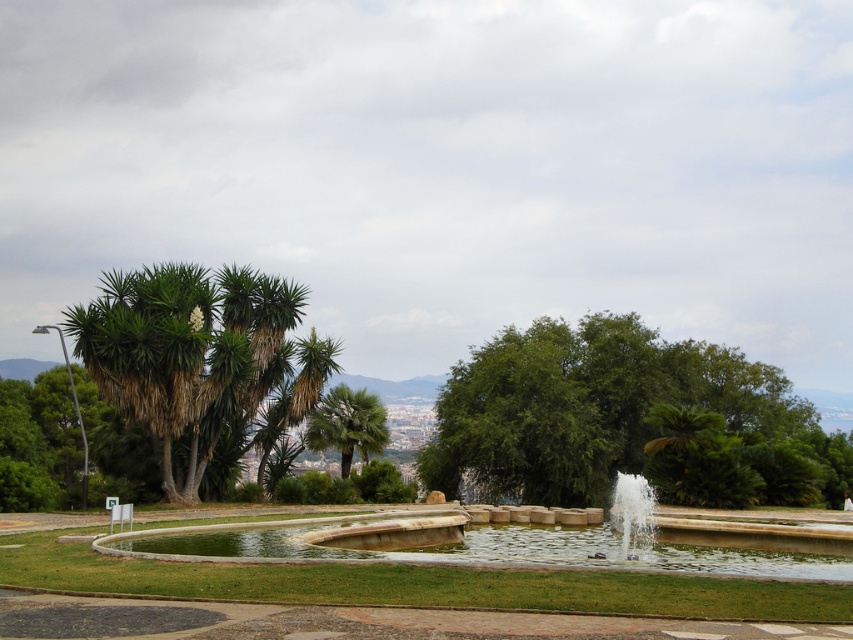
Does green leafy tree at center have a greater height compared to white stone fountain at lower right?

Correct, green leafy tree at center is much taller as white stone fountain at lower right.

Does point (585, 484) lie in front of point (630, 522)?

That is False.

Is point (808, 472) behind point (621, 497)?

Yes, point (808, 472) is behind point (621, 497).

In order to click on green leafy tree at center in this screenshot , I will do `click(627, 420)`.

Does green leafy palm tree at center have a lesser width compared to white stone fountain at lower right?

Yes.

This screenshot has width=853, height=640. Describe the element at coordinates (347, 424) in the screenshot. I see `green leafy palm tree at center` at that location.

Which is in front, point (347, 397) or point (639, 506)?

Point (639, 506)

The height and width of the screenshot is (640, 853). What are the coordinates of `green leafy palm tree at center` in the screenshot? It's located at (347, 424).

Does point (177, 269) come farther from viewer compared to point (616, 529)?

Yes, point (177, 269) is farther from viewer.

Is point (260, 388) farther from viewer compared to point (642, 532)?

That is True.

The image size is (853, 640). Find the location of `green leafy trees at left`. green leafy trees at left is located at coordinates (184, 355).